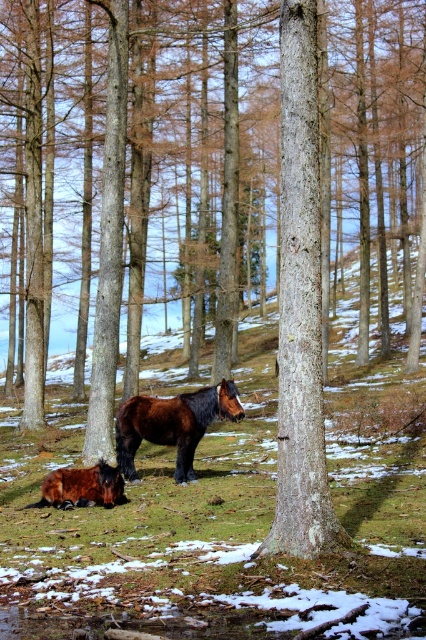
Question: Can you confirm if green grass at center is positioned to the right of smooth bark tree trunk at center?

Choices:
 (A) yes
 (B) no

Answer: (B)

Question: Can you confirm if smooth bark tree trunk at center is bigger than shiny brown horse at lower left?

Choices:
 (A) yes
 (B) no

Answer: (A)

Question: Does shiny brown horse at center have a lesser width compared to shiny brown horse at lower left?

Choices:
 (A) no
 (B) yes

Answer: (A)

Question: Which of the following is the closest to the observer?

Choices:
 (A) shiny brown horse at lower left
 (B) green grass at center
 (C) smooth bark tree trunk at center
 (D) shiny brown horse at center

Answer: (B)

Question: Which object is farther from the camera taking this photo?

Choices:
 (A) shiny brown horse at lower left
 (B) smooth bark tree trunk at center

Answer: (A)

Question: Estimate the real-world distances between objects in this image. Which object is farther from the green grass at center?

Choices:
 (A) shiny brown horse at center
 (B) shiny brown horse at lower left

Answer: (A)